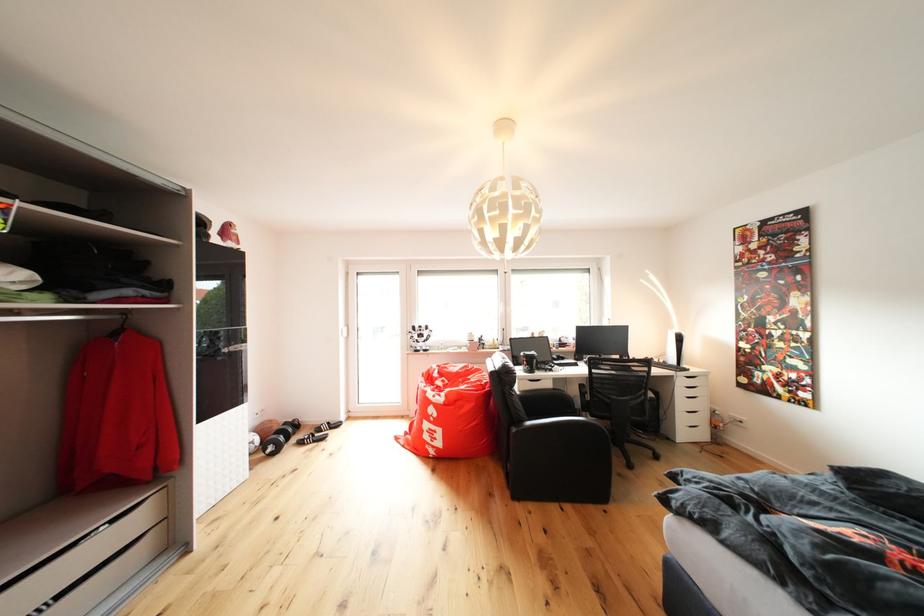
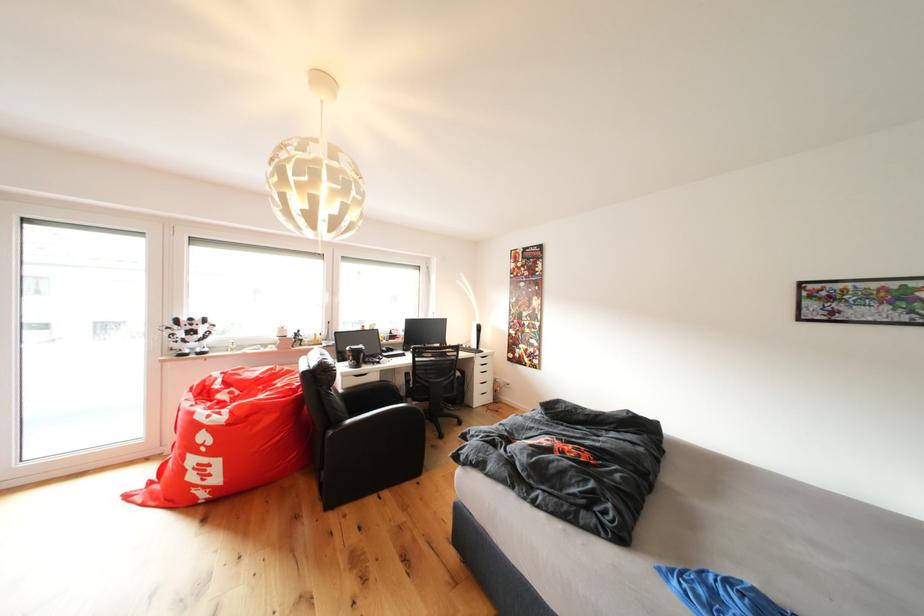
Find the pixel in the second image that matches [563,394] in the first image.

(390, 387)